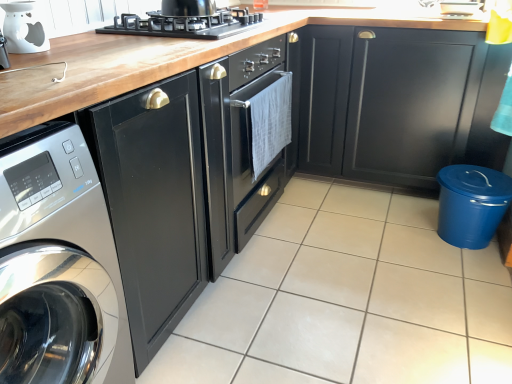
This screenshot has width=512, height=384. Describe the element at coordinates (185, 24) in the screenshot. I see `black matte gas stove at upper center` at that location.

Locate an element on the screen. satin silver washing machine at left is located at coordinates click(58, 265).

Does blue plastic trash can at lower right, which is the 1th appliance from back to front, have a lesser height compared to satin silver washing machine at left?

Yes, blue plastic trash can at lower right, which is the 1th appliance from back to front, is shorter than satin silver washing machine at left.

Does blue plastic trash can at lower right, which is the 1th appliance from back to front, lie behind satin silver washing machine at left?

Yes, it is behind satin silver washing machine at left.

Considering the sizes of objects blue plastic trash can at lower right, positioned as the first appliance in bottom-to-top order, and satin silver washing machine at left in the image provided, who is bigger, blue plastic trash can at lower right, positioned as the first appliance in bottom-to-top order, or satin silver washing machine at left?

With larger size is satin silver washing machine at left.

Locate an element on the screen. The width and height of the screenshot is (512, 384). the 2nd appliance above the white glossy tile at center (from the image's perspective) is located at coordinates (24, 28).

Is the surface of white glossy oil burner at upper left, the 2th appliance when ordered from back to front, in direct contact with white glossy tile at center?

No, white glossy oil burner at upper left, the 2th appliance when ordered from back to front, is not in contact with white glossy tile at center.

Which of these two, white glossy oil burner at upper left, the 1th appliance viewed from the top, or white glossy tile at center, is bigger?

white glossy tile at center.

Is point (44, 41) positioned before point (470, 256)?

Yes, point (44, 41) is closer to viewer.

In order to click on kitchen appliance on the right of satin silver washing machine at left in this screenshot , I will do `click(185, 24)`.

Measure the distance between black matte gas stove at upper center and satin silver washing machine at left.

A distance of 36.00 inches exists between black matte gas stove at upper center and satin silver washing machine at left.

Which is behind, point (212, 22) or point (7, 323)?

The point (212, 22) is behind.

Is satin silver washing machine at left inside the boundaries of glossy black cabinet at center, placed as the first cabinetry when sorted from left to right, or outside?

satin silver washing machine at left lies outside glossy black cabinet at center, placed as the first cabinetry when sorted from left to right.

In terms of size, does satin silver washing machine at left appear bigger or smaller than glossy black cabinet at center, marked as the 2th cabinetry in a right-to-left arrangement?

satin silver washing machine at left is smaller than glossy black cabinet at center, marked as the 2th cabinetry in a right-to-left arrangement.

Can you confirm if satin silver washing machine at left is thinner than glossy black cabinet at center, marked as the 2th cabinetry in a right-to-left arrangement?

Correct, the width of satin silver washing machine at left is less than that of glossy black cabinet at center, marked as the 2th cabinetry in a right-to-left arrangement.

Where is `home appliance directly beneath the glossy black cabinet at center, placed as the first cabinetry when sorted from left to right (from a real-world perspective)`? This screenshot has width=512, height=384. home appliance directly beneath the glossy black cabinet at center, placed as the first cabinetry when sorted from left to right (from a real-world perspective) is located at coordinates (58, 265).

Can you tell me how much satin silver washing machine at left and white glossy oil burner at upper left, the 2th appliance when ordered from back to front, differ in facing direction?

The angle between the facing direction of satin silver washing machine at left and the facing direction of white glossy oil burner at upper left, the 2th appliance when ordered from back to front, is 8.11 degrees.

Between satin silver washing machine at left and white glossy oil burner at upper left, arranged as the first appliance when viewed from the front, which one is positioned in front?

Positioned in front is satin silver washing machine at left.

Could you tell me if satin silver washing machine at left is turned towards white glossy oil burner at upper left, arranged as the first appliance when viewed from the front?

No.

In the scene shown: From a real-world perspective, is satin silver washing machine at left physically below white glossy oil burner at upper left, the 1th appliance positioned from the left?

Yes, from a real-world perspective, satin silver washing machine at left is under white glossy oil burner at upper left, the 1th appliance positioned from the left.

Considering the positions of objects satin silver washing machine at left and black matte gas stove at upper center in the image provided, who is behind, satin silver washing machine at left or black matte gas stove at upper center?

black matte gas stove at upper center is more distant.

Is point (42, 238) farther from camera compared to point (165, 35)?

That is False.

Is black matte gas stove at upper center inside satin silver washing machine at left?

Actually, black matte gas stove at upper center is outside satin silver washing machine at left.

Is satin silver washing machine at left oriented towards black matte gas stove at upper center?

No, satin silver washing machine at left is not oriented towards black matte gas stove at upper center.

Between blue plastic trash can at lower right, which is counted as the 2th appliance, starting from the front, and white glossy oil burner at upper left, the 1th appliance viewed from the top, which one has more height?

With more height is blue plastic trash can at lower right, which is counted as the 2th appliance, starting from the front.

How many degrees apart are the facing directions of blue plastic trash can at lower right, placed as the 1th appliance when sorted from right to left, and white glossy oil burner at upper left, the 2th appliance ordered from the bottom?

They differ by 178 degrees in their facing directions.

Is point (437, 178) more distant than point (30, 7)?

Yes, it is behind point (30, 7).

Where is `appliance behind the white glossy oil burner at upper left, arranged as the first appliance when viewed from the front`? appliance behind the white glossy oil burner at upper left, arranged as the first appliance when viewed from the front is located at coordinates 471,204.

Find the location of a particular element. home appliance above the blue plastic trash can at lower right, placed as the 1th appliance when sorted from right to left (from a real-world perspective) is located at coordinates (58, 265).

Find the location of a particular element. This screenshot has width=512, height=384. tile located underneath the white glossy oil burner at upper left, the 2th appliance when ordered from back to front (from a real-world perspective) is located at coordinates (347, 300).

Considering their positions, is blue plastic trash can at lower right, which is counted as the 2th appliance, starting from the left, positioned closer to matte black cabinet at lower right, the 1th cabinetry viewed from the right, than glossy black cabinet at center, marked as the 2th cabinetry in a right-to-left arrangement?

blue plastic trash can at lower right, which is counted as the 2th appliance, starting from the left, lies closer to matte black cabinet at lower right, the 1th cabinetry viewed from the right, than the other object.

Which object lies nearer to the anchor point glossy black cabinet at center, marked as the 2th cabinetry in a right-to-left arrangement, black matte gas stove at upper center or white glossy tile at center?

Based on the image, white glossy tile at center appears to be nearer to glossy black cabinet at center, marked as the 2th cabinetry in a right-to-left arrangement.

Which object lies nearer to the anchor point satin silver washing machine at left, white glossy tile at center or matte black cabinet at lower right, which is the second cabinetry from left to right?

white glossy tile at center lies closer to satin silver washing machine at left than the other object.

Based on their spatial positions, is white glossy tile at center or black matte gas stove at upper center further from matte black cabinet at lower right, which is the second cabinetry from left to right?

black matte gas stove at upper center lies further to matte black cabinet at lower right, which is the second cabinetry from left to right, than the other object.

When comparing their distances from white glossy oil burner at upper left, the 2th appliance ordered from the bottom, does white glossy tile at center or black matte gas stove at upper center seem closer?

black matte gas stove at upper center is positioned closer to the anchor white glossy oil burner at upper left, the 2th appliance ordered from the bottom.

Which object lies further to the anchor point blue plastic trash can at lower right, which is the 1th appliance from back to front, matte black cabinet at lower right, which is the second cabinetry from left to right, or satin silver washing machine at left?

Based on the image, satin silver washing machine at left appears to be further to blue plastic trash can at lower right, which is the 1th appliance from back to front.

From the picture: Estimate the real-world distances between objects in this image. Which object is closer to glossy black cabinet at center, placed as the first cabinetry when sorted from left to right, blue plastic trash can at lower right, which is counted as the 2th appliance, starting from the front, or black matte gas stove at upper center?

The object closer to glossy black cabinet at center, placed as the first cabinetry when sorted from left to right, is black matte gas stove at upper center.

Estimate the real-world distances between objects in this image. Which object is further from glossy black cabinet at center, marked as the 2th cabinetry in a right-to-left arrangement, black matte gas stove at upper center or white glossy oil burner at upper left, the 2th appliance in the right-to-left sequence?

white glossy oil burner at upper left, the 2th appliance in the right-to-left sequence, is positioned further to the anchor glossy black cabinet at center, marked as the 2th cabinetry in a right-to-left arrangement.

In order to click on cabinetry located between white glossy oil burner at upper left, arranged as the first appliance when viewed from the front, and matte black cabinet at lower right, the 1th cabinetry viewed from the right, in the left-right direction in this screenshot , I will do `click(164, 195)`.

This screenshot has width=512, height=384. Find the location of `appliance between satin silver washing machine at left and matte black cabinet at lower right, the 1th cabinetry viewed from the right`. appliance between satin silver washing machine at left and matte black cabinet at lower right, the 1th cabinetry viewed from the right is located at coordinates (24, 28).

In order to click on tile situated between satin silver washing machine at left and matte black cabinet at lower right, which is the second cabinetry from left to right, from left to right in this screenshot , I will do `click(347, 300)`.

You are a GUI agent. You are given a task and a screenshot of the screen. Output one action in this format:
    pyautogui.click(x=<x>, y=<y>)
    Task: Click on the kitchen appliance between white glossy oil burner at upper left, the 1th appliance positioned from the left, and matte black cabinet at lower right, which is the second cabinetry from left to right, in the horizontal direction
    The width and height of the screenshot is (512, 384).
    Given the screenshot: What is the action you would take?
    pyautogui.click(x=185, y=24)